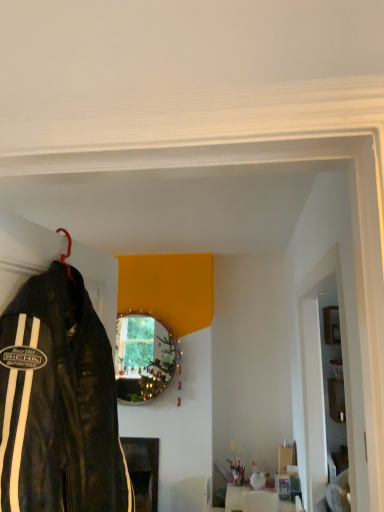
Question: In which direction should I rotate to look at white glossy vase at center, which appears as the second furniture when viewed from the left?

Choices:
 (A) left
 (B) right

Answer: (B)

Question: Is the position of white glossy vase at center, which appears as the second furniture when viewed from the left, more distant than that of metallic reflective mirror at center?

Choices:
 (A) yes
 (B) no

Answer: (B)

Question: Is white glossy vase at center, acting as the first furniture starting from the front, at the right side of metallic reflective mirror at center?

Choices:
 (A) no
 (B) yes

Answer: (B)

Question: From a real-world perspective, is white glossy vase at center, acting as the first furniture starting from the front, positioned over metallic reflective mirror at center based on gravity?

Choices:
 (A) yes
 (B) no

Answer: (B)

Question: Is white glossy vase at center, the second furniture in the back-to-front sequence, taller than metallic reflective mirror at center?

Choices:
 (A) yes
 (B) no

Answer: (B)

Question: Considering the relative positions of white glossy vase at center, acting as the first furniture starting from the front, and metallic reflective mirror at center in the image provided, is white glossy vase at center, acting as the first furniture starting from the front, in front of metallic reflective mirror at center?

Choices:
 (A) yes
 (B) no

Answer: (A)

Question: Is white glossy vase at center, which is the 1th furniture from right to left, surrounding metallic reflective mirror at center?

Choices:
 (A) yes
 (B) no

Answer: (B)

Question: Can you confirm if white glossy door at right is bigger than black leather jacket at left?

Choices:
 (A) yes
 (B) no

Answer: (A)

Question: Is white glossy door at right smaller than black leather jacket at left?

Choices:
 (A) no
 (B) yes

Answer: (A)

Question: Would you say white glossy door at right is outside black leather jacket at left?

Choices:
 (A) yes
 (B) no

Answer: (A)

Question: Could you tell me if white glossy door at right is turned towards black leather jacket at left?

Choices:
 (A) no
 (B) yes

Answer: (A)

Question: Can you confirm if white glossy door at right is thinner than black leather jacket at left?

Choices:
 (A) yes
 (B) no

Answer: (A)

Question: From the image's perspective, is white glossy door at right under black leather jacket at left?

Choices:
 (A) yes
 (B) no

Answer: (A)

Question: Is the depth of white glossy door at right greater than that of white glossy vase at center, acting as the first furniture starting from the front?

Choices:
 (A) no
 (B) yes

Answer: (A)